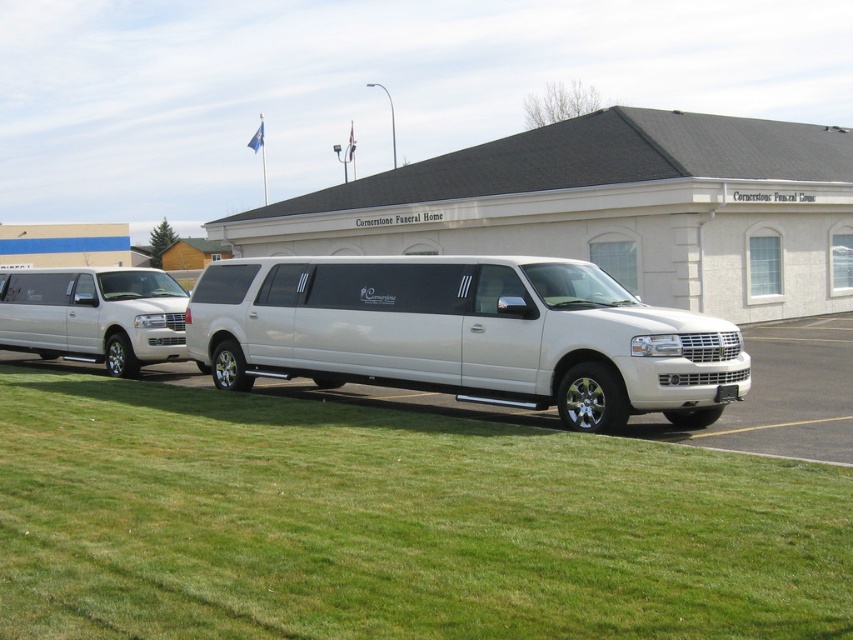
Can you confirm if green grass at lower center is shorter than matte silver minivan at left?

Indeed, green grass at lower center has a lesser height compared to matte silver minivan at left.

Who is more forward, (196, 627) or (90, 314)?

Point (196, 627) is in front.

Identify the location of green grass at lower center. This screenshot has height=640, width=853. (392, 524).

From the picture: Can you confirm if white metallic van at center is thinner than matte silver minivan at left?

In fact, white metallic van at center might be wider than matte silver minivan at left.

Consider the image. Is white metallic van at center to the left of matte silver minivan at left from the viewer's perspective?

Incorrect, white metallic van at center is not on the left side of matte silver minivan at left.

Who is more distant from viewer, (207,356) or (21,284)?

The point (21,284) is more distant.

Locate an element on the screen. white metallic van at center is located at coordinates (466, 333).

Does green grass at lower center have a lesser height compared to white metallic van at center?

Yes, green grass at lower center is shorter than white metallic van at center.

Where is `green grass at lower center`? Image resolution: width=853 pixels, height=640 pixels. green grass at lower center is located at coordinates (392, 524).